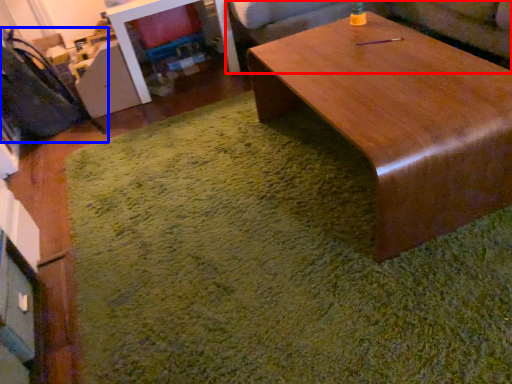
Question: Which of the following is the closest to the observer, couch (highlighted by a red box) or swivel chair (highlighted by a blue box)?

Choices:
 (A) couch
 (B) swivel chair

Answer: (B)